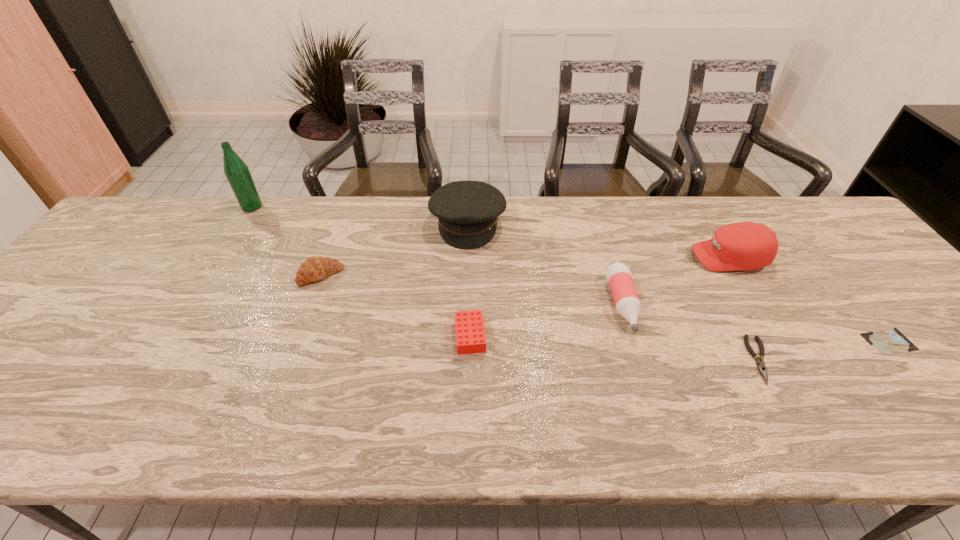
Locate an element on the screen. identity card is located at coordinates (891, 341).

This screenshot has width=960, height=540. I want to click on the rightmost object, so click(891, 341).

Locate an element on the screen. The height and width of the screenshot is (540, 960). vacant space located 0.360m on the right of the taller bottle is located at coordinates pos(376,207).

What are the coordinates of `vacant space located 0.370m on the front-facing side of the beret` in the screenshot? It's located at (464, 359).

At what (x,y) coordinates should I click in order to perform the action: click on free space located on the front-facing side of the cap. Please return your answer as a coordinate pair (x, y). The width and height of the screenshot is (960, 540). Looking at the image, I should click on click(633, 258).

This screenshot has height=540, width=960. Find the location of `free location located 0.270m on the front-facing side of the cap`. free location located 0.270m on the front-facing side of the cap is located at coordinates (593, 258).

Find the location of `free space located 0.220m on the front-facing side of the cap`. free space located 0.220m on the front-facing side of the cap is located at coordinates (612, 258).

Locate an element on the screen. vacant space situated 0.140m with the cap open on the shorter bottle is located at coordinates (649, 393).

The image size is (960, 540). I want to click on free point located on the left of the crescent roll, so click(176, 275).

The width and height of the screenshot is (960, 540). I want to click on vacant space located on the right of the Lego, so point(563,336).